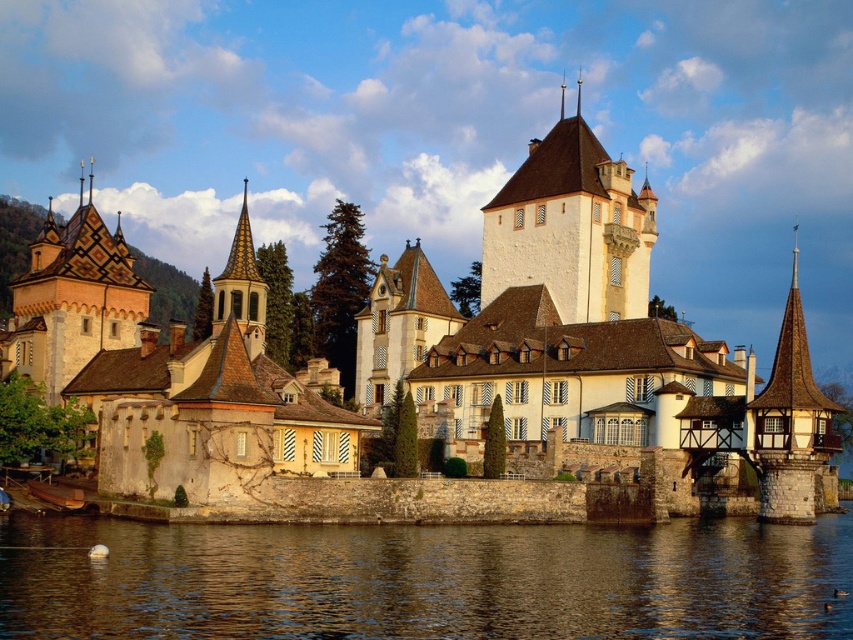
Who is shorter, white stone castle at center or smooth gray steeple at center?

smooth gray steeple at center is shorter.

Where is `white stone castle at center`? white stone castle at center is located at coordinates (593, 349).

Find the location of `white stone castle at center`. white stone castle at center is located at coordinates (593, 349).

From the picture: Which is more to the left, white stone tower at upper center or smooth gray steeple at center?

From the viewer's perspective, smooth gray steeple at center appears more on the left side.

Where is `white stone tower at upper center`? white stone tower at upper center is located at coordinates (572, 227).

Find the location of a particular element. This screenshot has width=853, height=640. white stone tower at upper center is located at coordinates (x=572, y=227).

Between brown water at lower center and smooth gray steeple at center, which one is positioned lower?

Positioned lower is brown water at lower center.

Between point (637, 609) and point (241, 212), which one is positioned in front?

Point (637, 609) is in front.

In order to click on brown water at lower center in this screenshot , I will do `click(425, 579)`.